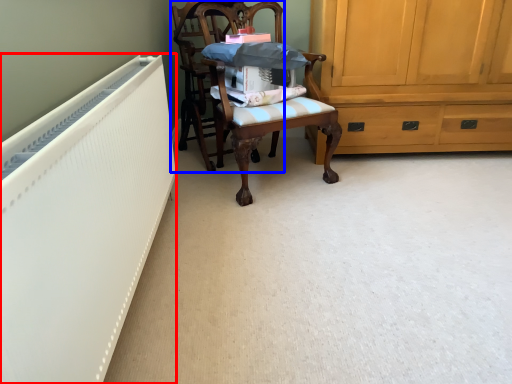
Question: Which point is further to the camera, radiator (highlighted by a red box) or chair (highlighted by a blue box)?

Choices:
 (A) radiator
 (B) chair

Answer: (B)